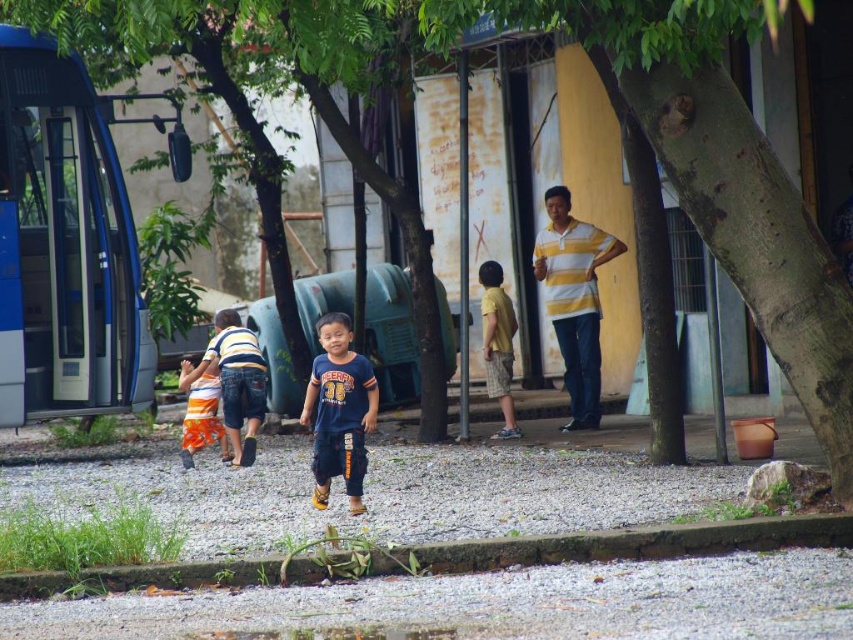
Locate an element on the screen. This screenshot has height=640, width=853. green leafy tree at center is located at coordinates (257, 120).

Is green leafy tree at center thinner than yellow cotton shirt at center?

Incorrect, green leafy tree at center's width is not less than yellow cotton shirt at center's.

Who is more forward, (57, 4) or (490, 262)?

Point (57, 4) is in front.

Find the location of a particular element. Image resolution: width=853 pixels, height=640 pixels. green leafy tree at center is located at coordinates (257, 120).

Does point (106, 74) come in front of point (349, 396)?

No, it is not.

Which is behind, point (250, 148) or point (360, 365)?

Positioned behind is point (250, 148).

Does point (196, 22) come closer to viewer compared to point (349, 419)?

No.

Locate an element on the screen. Image resolution: width=853 pixels, height=640 pixels. green leafy tree at center is located at coordinates (257, 120).

Looking at this image, does green leafy tree at center have a smaller size compared to orange cotton shorts at center?

No.

Can you confirm if green leafy tree at center is thinner than orange cotton shorts at center?

Incorrect, green leafy tree at center's width is not less than orange cotton shorts at center's.

What are the coordinates of `green leafy tree at center` in the screenshot? It's located at (257, 120).

Find the location of a particular element. The width and height of the screenshot is (853, 640). green leafy tree at center is located at coordinates (257, 120).